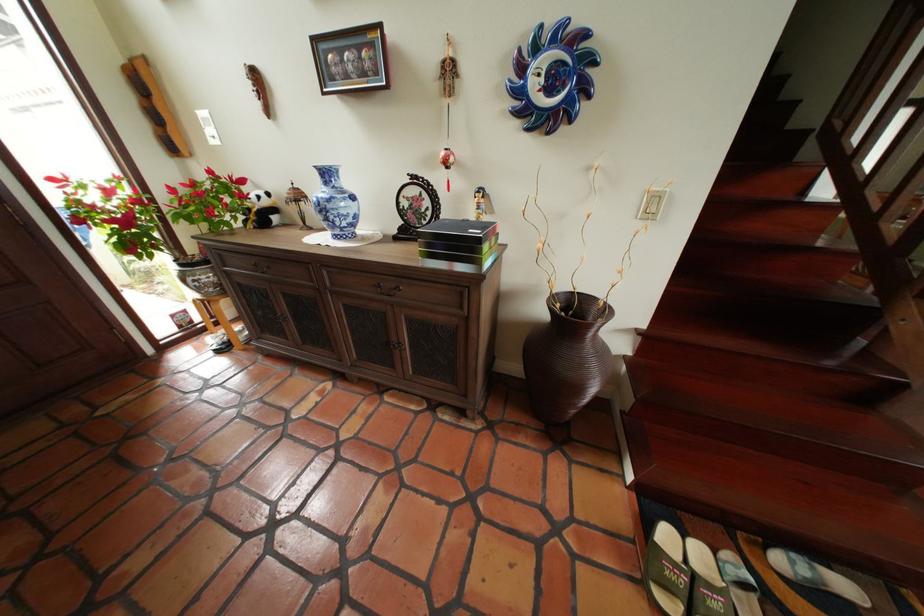
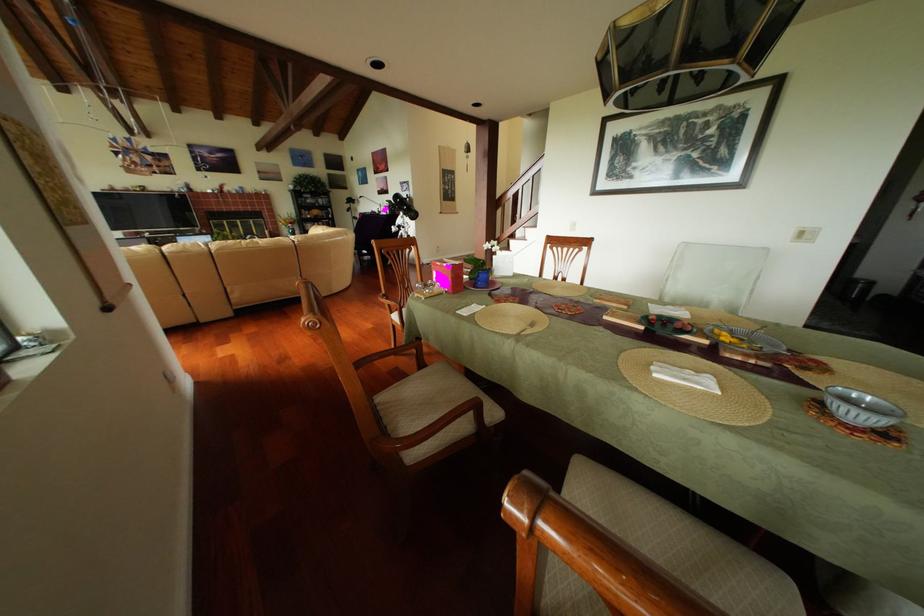
Question: I am providing you with two images of the same scene from different viewpoints. Please identify which objects are invisible in image2.

Choices:
 (A) blue flower pot
 (B) metal fork
 (C) folding luggage rack
 (D) blue and white vase

Answer: (D)